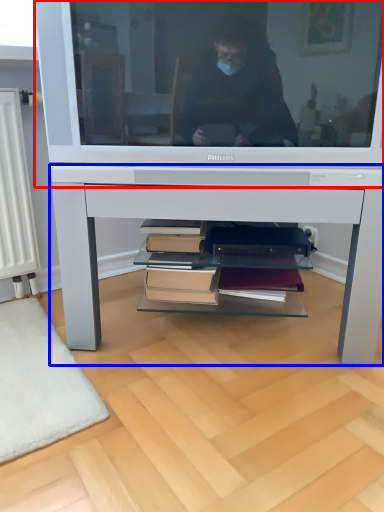
Question: Among these objects, which one is nearest to the camera, television (highlighted by a red box) or desk (highlighted by a blue box)?

Choices:
 (A) television
 (B) desk

Answer: (A)